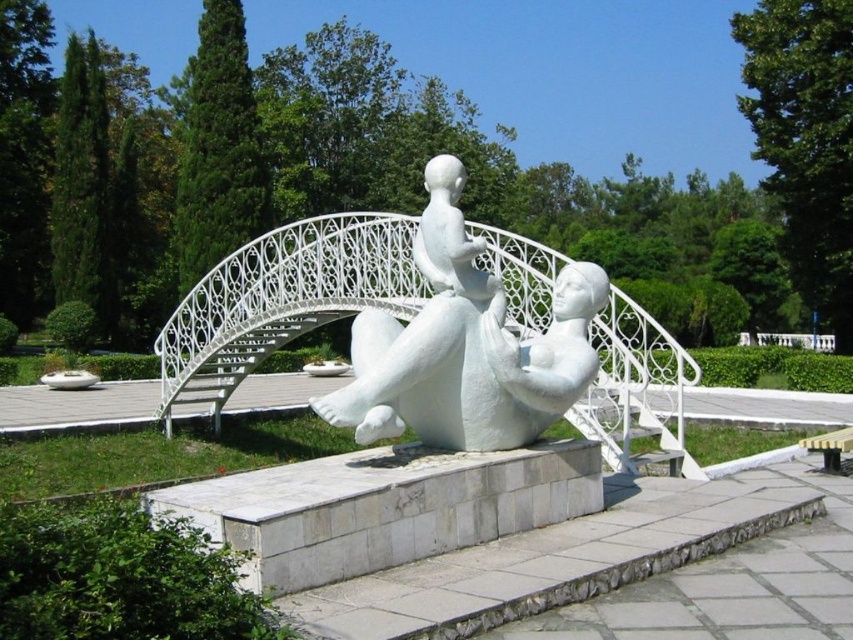
Question: Which object is closer to the camera taking this photo?

Choices:
 (A) white wrought iron bridge at center
 (B) white marble sculpture at center

Answer: (A)

Question: Is white wrought iron bridge at center thinner than white marble sculpture at center?

Choices:
 (A) yes
 (B) no

Answer: (B)

Question: Which of the following is the farthest from the observer?

Choices:
 (A) white marble sculpture at center
 (B) white wrought iron bridge at center

Answer: (A)

Question: Can you confirm if white wrought iron bridge at center is positioned to the right of white marble sculpture at center?

Choices:
 (A) yes
 (B) no

Answer: (B)

Question: Which point appears farthest from the camera in this image?

Choices:
 (A) (503, 328)
 (B) (590, 396)

Answer: (B)

Question: Does white wrought iron bridge at center lie behind white marble sculpture at center?

Choices:
 (A) yes
 (B) no

Answer: (B)